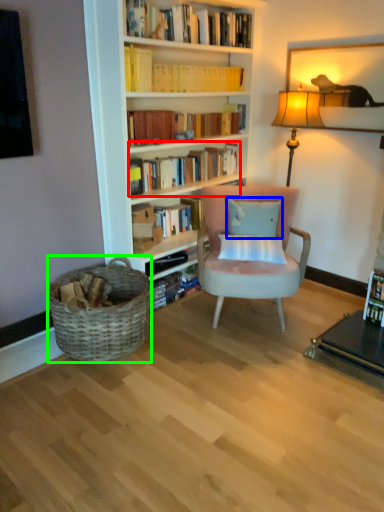
Question: Which object is the closest to the book (highlighted by a red box)? Choose among these: pillow (highlighted by a blue box) or picnic basket (highlighted by a green box).

Choices:
 (A) pillow
 (B) picnic basket

Answer: (A)